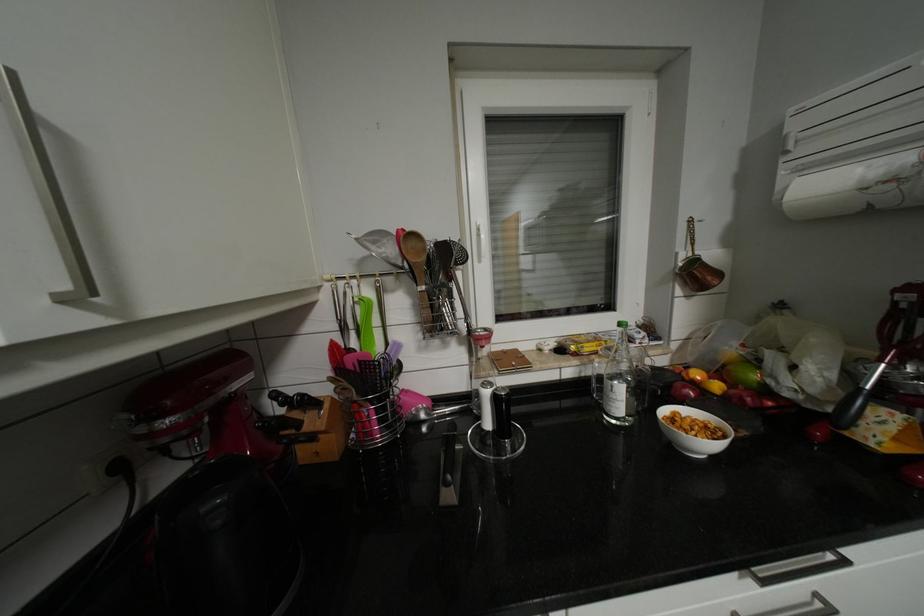
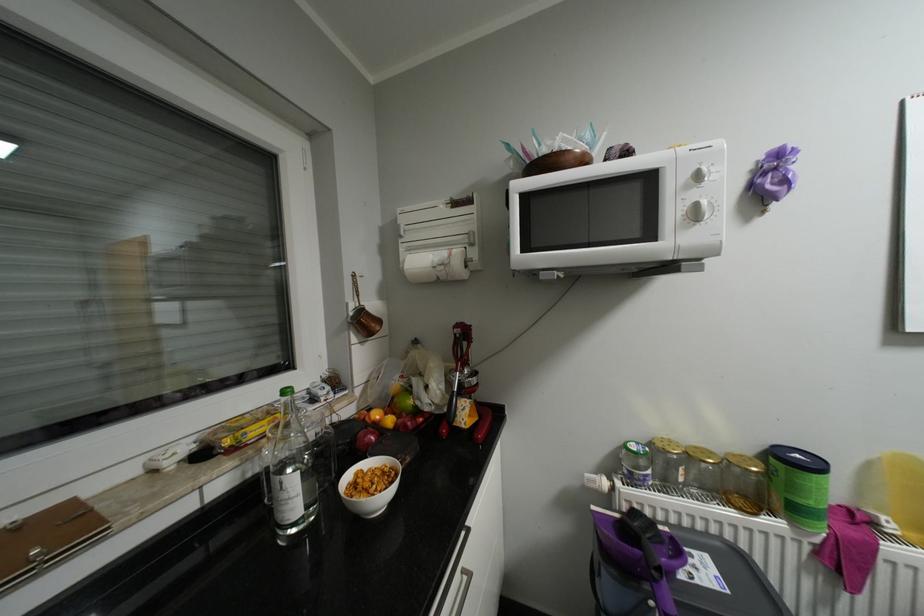
Question: The camera is either moving clockwise (left) or counter-clockwise (right) around the object. The first image is from the beginning of the video and the second image is from the end. Is the camera moving left or right when shooting the video?

Choices:
 (A) Left
 (B) Right

Answer: (A)